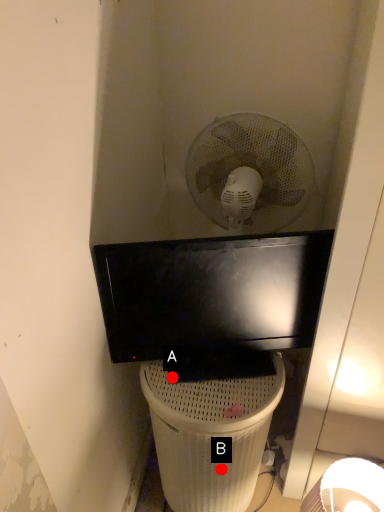
Question: Two points are circled on the image, labeled by A and B beside each circle. Which point is closer to the camera taking this photo?

Choices:
 (A) A is closer
 (B) B is closer

Answer: (A)